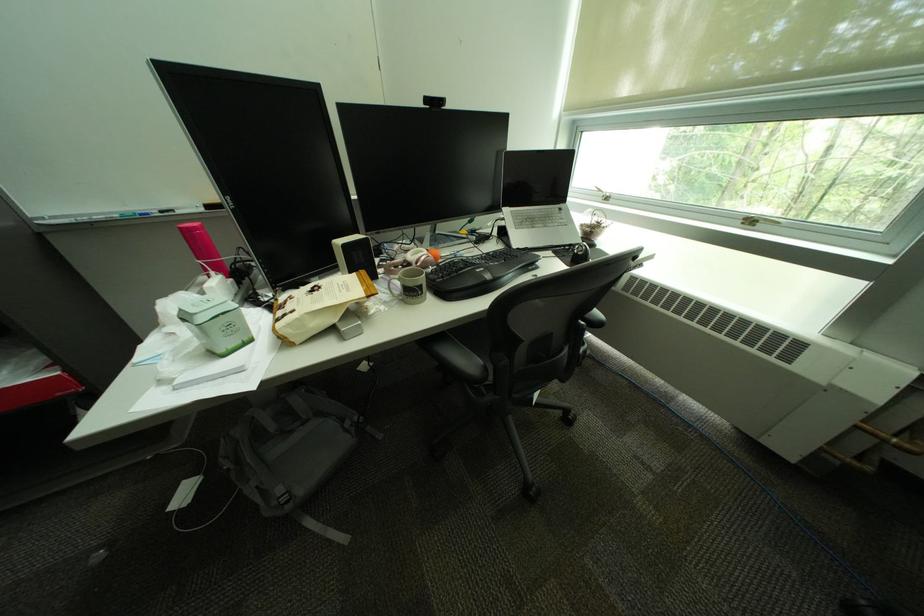
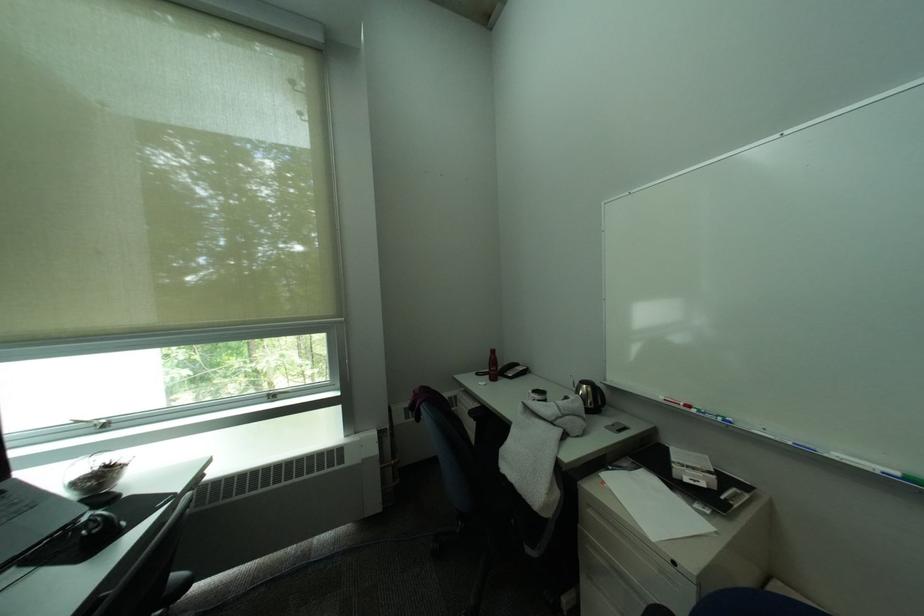
Question: I am providing you with two images of the same scene from different viewpoints. Please identify which objects are invisible in image2.

Choices:
 (A) cabinet drawer handle
 (B) black kettle handle
 (C) telephone handset
 (D) none of these

Answer: (D)